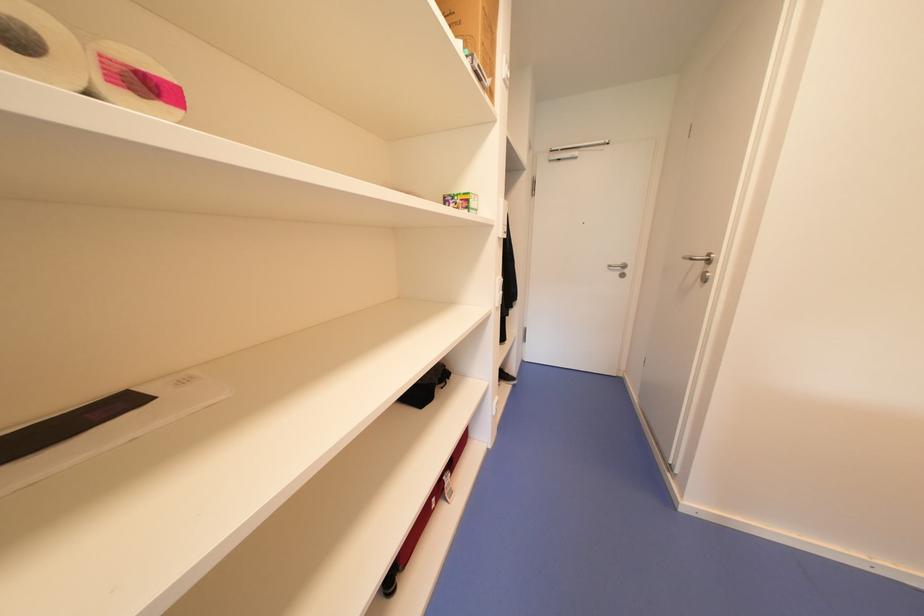
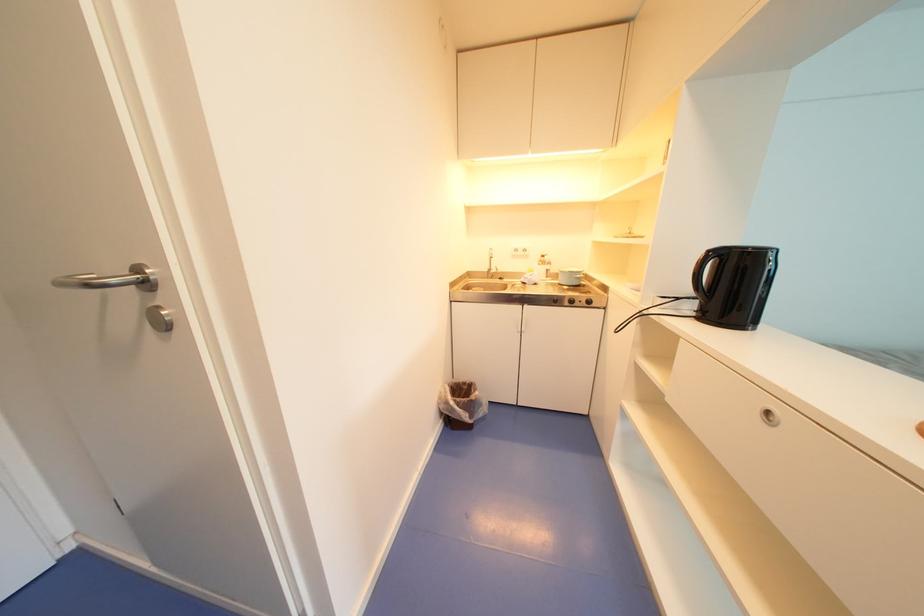
First-person continuous shooting, in which direction is the camera rotating?

The camera's rotation is toward right-down.